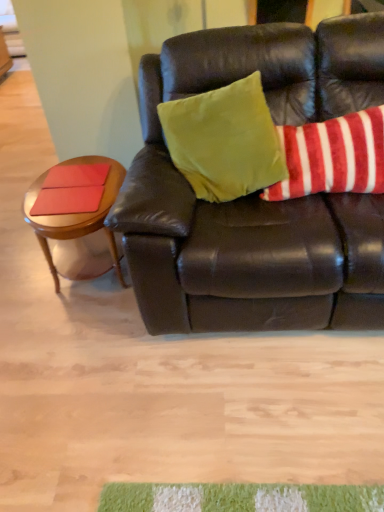
Locate an element on the screen. The image size is (384, 512). free space to the left of woodenwoodentable at left is located at coordinates (21, 269).